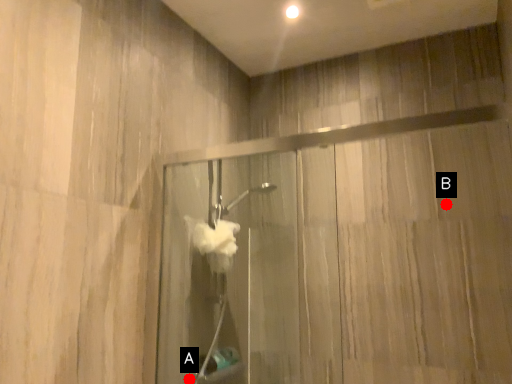
Question: Two points are circled on the image, labeled by A and B beside each circle. Which point is further to the camera?

Choices:
 (A) A is further
 (B) B is further

Answer: (B)